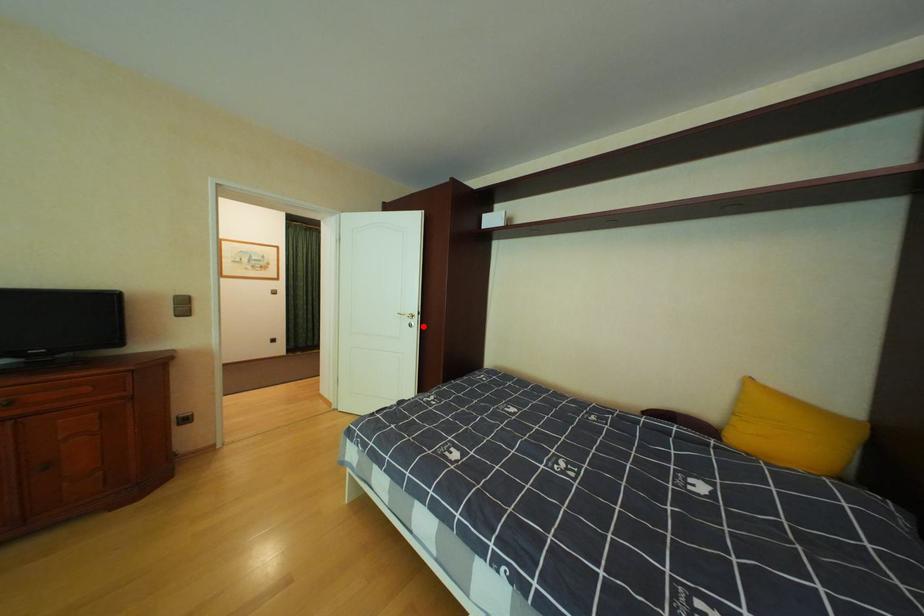
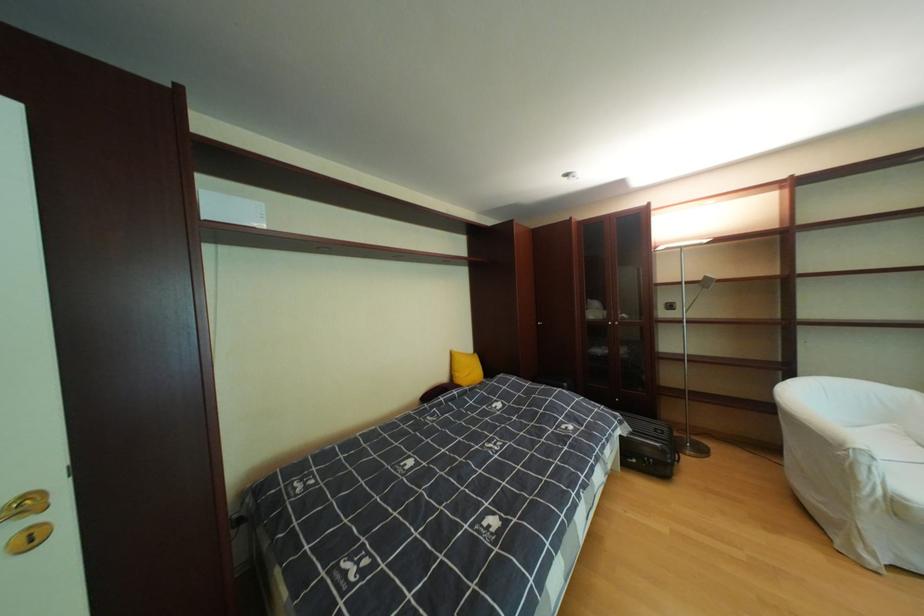
The point at the highlighted location is marked in the first image. Where is the corresponding point in the second image?

(43, 541)